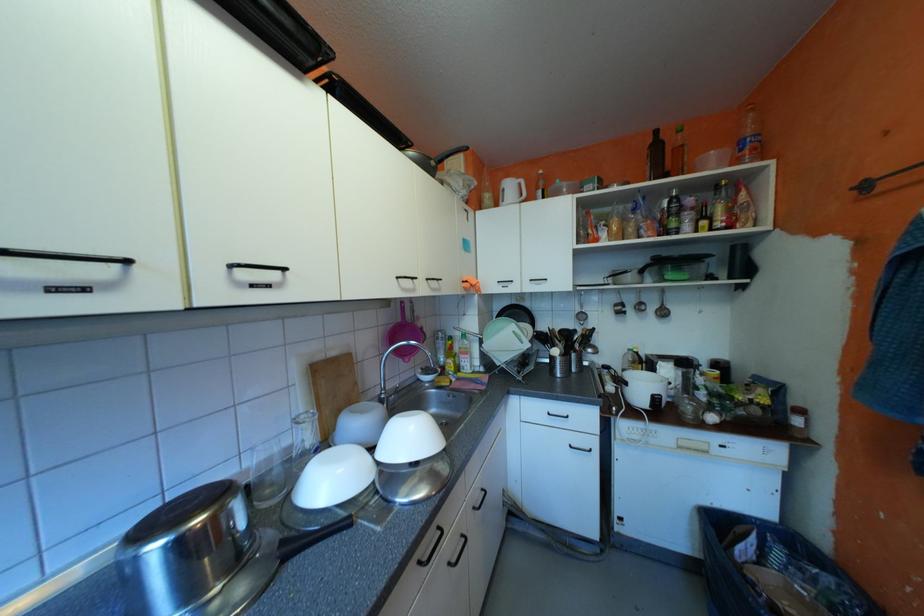
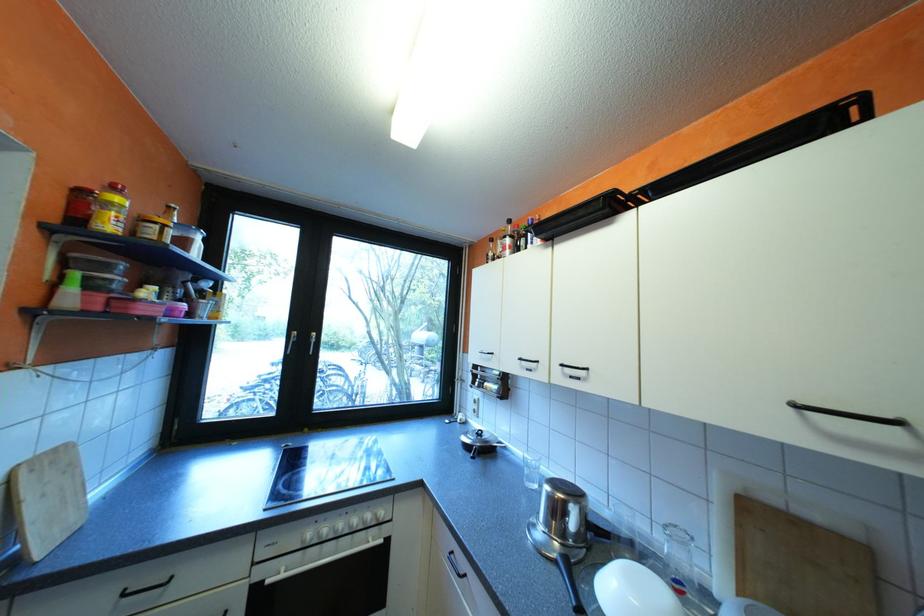
Find the pixel in the second image that matches point (248, 282) in the first image.

(576, 373)